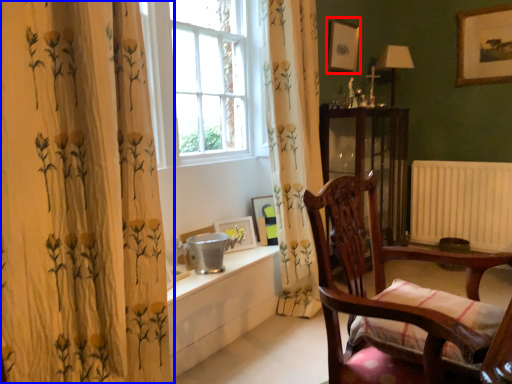
Question: Which object appears closest to the camera in this image, picture frame (highlighted by a red box) or curtain (highlighted by a blue box)?

Choices:
 (A) picture frame
 (B) curtain

Answer: (B)